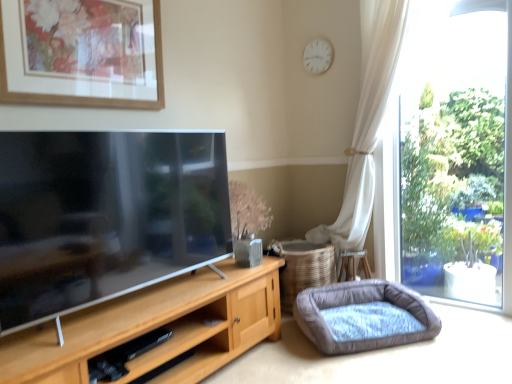
Question: Is matte wooden picture frame at upper left further to the viewer compared to white matte clock at upper center?

Choices:
 (A) yes
 (B) no

Answer: (B)

Question: From the image's perspective, is matte wooden picture frame at upper left located above white matte clock at upper center?

Choices:
 (A) yes
 (B) no

Answer: (B)

Question: Is matte wooden picture frame at upper left facing away from white matte clock at upper center?

Choices:
 (A) yes
 (B) no

Answer: (B)

Question: Does matte wooden picture frame at upper left turn towards white matte clock at upper center?

Choices:
 (A) no
 (B) yes

Answer: (A)

Question: Is matte wooden picture frame at upper left taller than white matte clock at upper center?

Choices:
 (A) yes
 (B) no

Answer: (A)

Question: Is matte wooden picture frame at upper left to the left of white matte clock at upper center from the viewer's perspective?

Choices:
 (A) yes
 (B) no

Answer: (A)

Question: Does velvet grey dog bed at lower right have a lesser width compared to white matte clock at upper center?

Choices:
 (A) no
 (B) yes

Answer: (A)

Question: Is velvet grey dog bed at lower right facing towards white matte clock at upper center?

Choices:
 (A) yes
 (B) no

Answer: (B)

Question: Are velvet grey dog bed at lower right and white matte clock at upper center far apart?

Choices:
 (A) no
 (B) yes

Answer: (B)

Question: From a real-world perspective, is velvet grey dog bed at lower right under white matte clock at upper center?

Choices:
 (A) no
 (B) yes

Answer: (B)

Question: Is white matte clock at upper center completely or partially inside velvet grey dog bed at lower right?

Choices:
 (A) no
 (B) yes

Answer: (A)

Question: Is velvet grey dog bed at lower right completely or partially outside of white matte clock at upper center?

Choices:
 (A) yes
 (B) no

Answer: (A)

Question: From the image's perspective, is white matte clock at upper center below velvet grey dog bed at lower right?

Choices:
 (A) no
 (B) yes

Answer: (A)